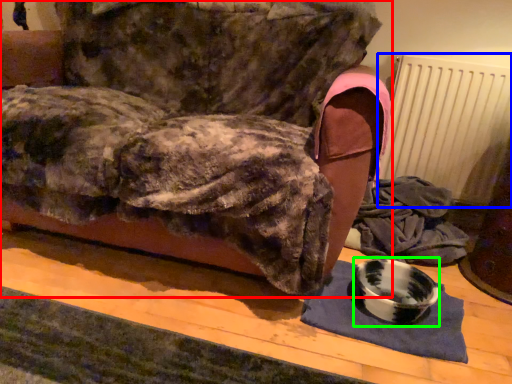
Question: Based on their relative distances, which object is nearer to furniture (highlighted by a red box)? Choose from radiator (highlighted by a blue box) and bowl (highlighted by a green box).

Choices:
 (A) radiator
 (B) bowl

Answer: (B)